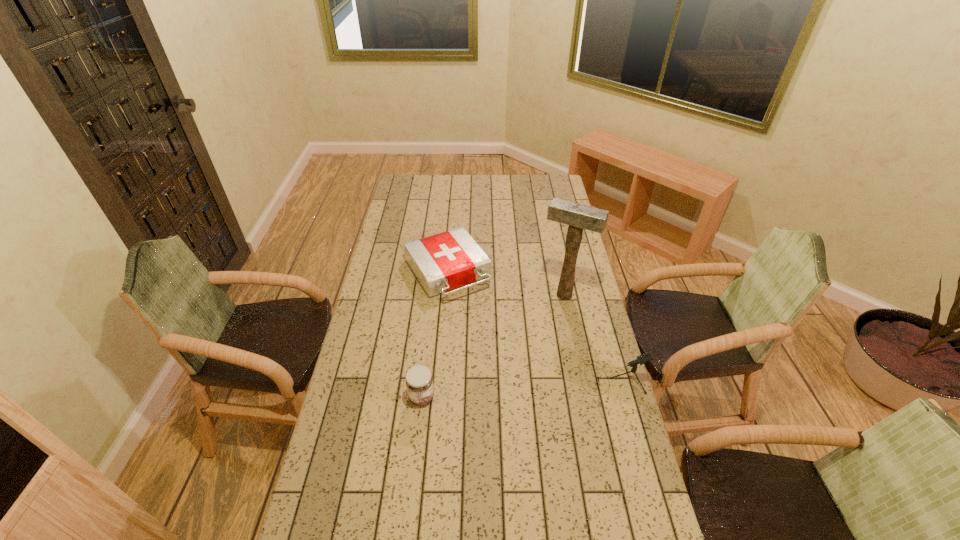
I want to click on vacant area at the right edge of the desktop, so click(x=590, y=304).

This screenshot has height=540, width=960. Identify the location of vacant space at the far left corner. (413, 180).

The height and width of the screenshot is (540, 960). Find the location of `blank space at the far right corner of the desktop`. blank space at the far right corner of the desktop is located at coordinates (549, 187).

Identify the location of vacant area that lies between the microphone and the mallet. (588, 336).

At what (x,y) coordinates should I click in order to perform the action: click on free point between the jam and the mallet. Please return your answer as a coordinate pair (x, y). Looking at the image, I should click on (492, 346).

You are a GUI agent. You are given a task and a screenshot of the screen. Output one action in this format:
    pyautogui.click(x=<x>, y=<y>)
    Task: Click on the vacant area that lies between the jam and the microphone
    The width and height of the screenshot is (960, 540).
    Given the screenshot: What is the action you would take?
    pyautogui.click(x=517, y=387)

Find the location of a particular element. The width and height of the screenshot is (960, 540). vacant point located between the tallest object and the jam is located at coordinates (492, 346).

Identify the location of empty space that is in between the tallest object and the jam. The image size is (960, 540). (492, 346).

Find the location of a particular element. The image size is (960, 540). vacant area that lies between the first-aid kit and the jam is located at coordinates (434, 335).

You are a GUI agent. You are given a task and a screenshot of the screen. Output one action in this format:
    pyautogui.click(x=<x>, y=<y>)
    Task: Click on the free point between the jam and the first-aid kit
    
    Given the screenshot: What is the action you would take?
    pyautogui.click(x=434, y=335)